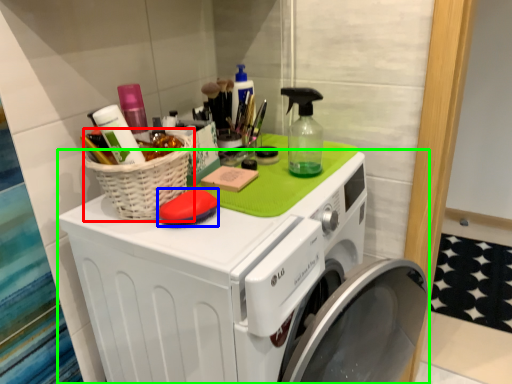
Question: Estimate the real-world distances between objects in this image. Which object is farther from basket (highlighted by a red box), soap (highlighted by a blue box) or washing machine (highlighted by a green box)?

Choices:
 (A) soap
 (B) washing machine

Answer: (B)